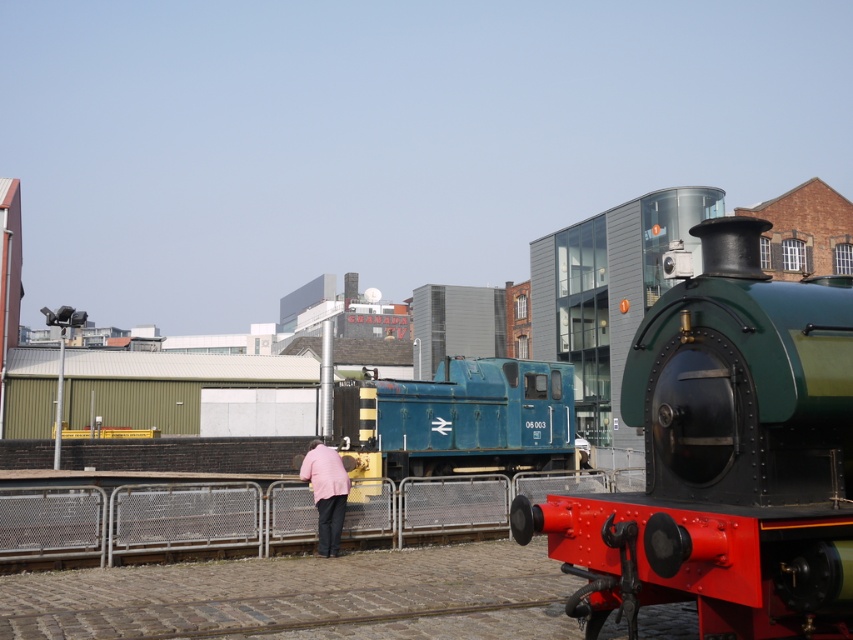
Question: Is green polished metal train at center to the right of blue painted metal train at center from the viewer's perspective?

Choices:
 (A) yes
 (B) no

Answer: (A)

Question: Which object is farther from the camera taking this photo?

Choices:
 (A) metallic fence at center
 (B) blue painted metal train at center
 (C) green polished metal train at center

Answer: (A)

Question: Which point is closer to the camera taking this photo?

Choices:
 (A) (312, 448)
 (B) (401, 516)

Answer: (A)

Question: In this image, where is green polished metal train at center located relative to metallic fence at center?

Choices:
 (A) right
 (B) left

Answer: (B)

Question: Is green polished metal train at center positioned behind metallic fence at center?

Choices:
 (A) yes
 (B) no

Answer: (B)

Question: Which object appears farthest from the camera in this image?

Choices:
 (A) green polished metal train at center
 (B) metallic fence at center
 (C) pink fabric jacket at center
 (D) blue painted metal train at center

Answer: (B)